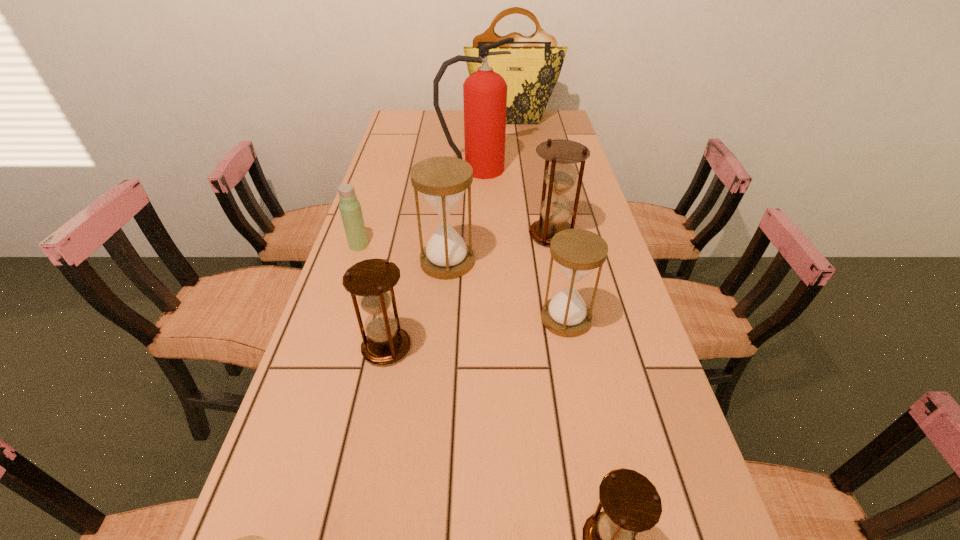
This screenshot has height=540, width=960. Identify the location of the second smallest brown hourglass. (372, 280).

Where is `light thermos bottle`? This screenshot has height=540, width=960. light thermos bottle is located at coordinates (350, 208).

Find the location of a particular element. The image size is (960, 540). free region located on the front-facing side of the yellow tote bag is located at coordinates (518, 165).

The height and width of the screenshot is (540, 960). What are the coordinates of `blank space located on the handle side of the second farthest object` in the screenshot? It's located at (543, 170).

The height and width of the screenshot is (540, 960). Identify the location of free space located 0.100m on the back of the farthest brown hourglass. (545, 203).

The image size is (960, 540). What are the coordinates of `vacant space situated on the right of the farthest white hourglass` in the screenshot? It's located at (556, 262).

Where is `blank space located 0.090m on the front of the second nearest white hourglass`? blank space located 0.090m on the front of the second nearest white hourglass is located at coordinates (576, 371).

Identify the location of free space located 0.070m on the back of the leftmost brown hourglass. (395, 307).

Find the location of a particular element. The image size is (960, 540). vacant point located 0.260m on the front of the light thermos bottle is located at coordinates 333,322.

Where is `object situated at the far edge`? The image size is (960, 540). object situated at the far edge is located at coordinates tap(531, 71).